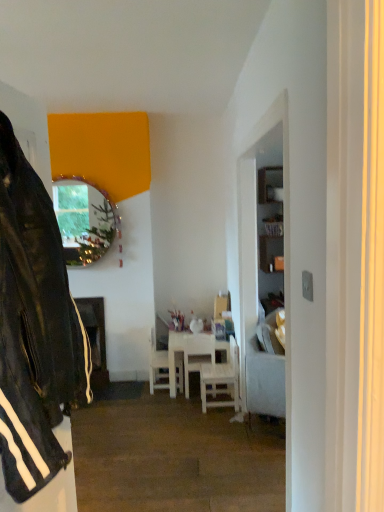
At what (x,y) coordinates should I click in order to perform the action: click on vacant region below white wooden chair at center, which is the 1th chair from right to left (from a real-world perspective). Please return your answer as a coordinate pair (x, y). This screenshot has width=384, height=512. Looking at the image, I should click on (213, 402).